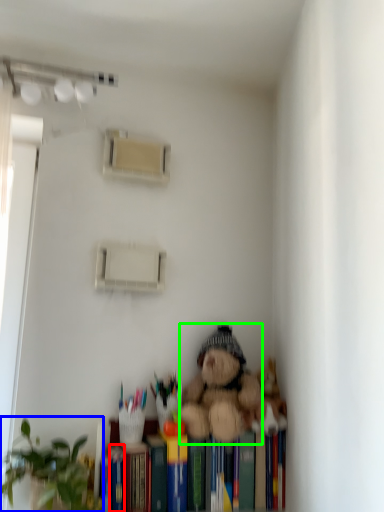
Question: Which is farther away from paperback book (highlighted by a red box)? houseplant (highlighted by a blue box) or teddy bear (highlighted by a green box)?

Choices:
 (A) houseplant
 (B) teddy bear

Answer: (B)